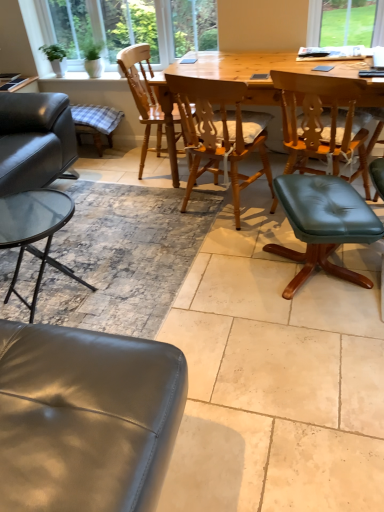
The height and width of the screenshot is (512, 384). What do you see at coordinates (225, 80) in the screenshot?
I see `natural wood table at center` at bounding box center [225, 80].

Describe the element at coordinates (323, 224) in the screenshot. The width and height of the screenshot is (384, 512). I see `teal leather stool at center-right, positioned as the 2th bar stool in top-to-bottom order` at that location.

How much space does plaid fabric cushion at left, which is the 1th bar stool in left-to-right order, occupy horizontally?

plaid fabric cushion at left, which is the 1th bar stool in left-to-right order, is 13.10 inches in width.

What do you see at coordinates (320, 123) in the screenshot? I see `green leather stool at center, the third chair positioned from the left` at bounding box center [320, 123].

I want to click on natural wood table at center, so click(x=225, y=80).

In the scene shown: Considering the relative sizes of wooden chair at center, which appears as the second chair when viewed from the left, and natural wood table at center in the image provided, is wooden chair at center, which appears as the second chair when viewed from the left, smaller than natural wood table at center?

Yes, wooden chair at center, which appears as the second chair when viewed from the left, is smaller than natural wood table at center.

In the scene shown: Can you tell me how much wooden chair at center, which appears as the second chair when viewed from the left, and natural wood table at center differ in facing direction?

wooden chair at center, which appears as the second chair when viewed from the left, and natural wood table at center are facing 164 degrees away from each other.

In the scene shown: Looking at their sizes, would you say wooden chair at center, the second chair in the right-to-left sequence, is wider or thinner than natural wood table at center?

wooden chair at center, the second chair in the right-to-left sequence, is thinner than natural wood table at center.

Where is `kitchen & dining room table above the wooden chair at center, the second chair in the right-to-left sequence (from the image's perspective)`? This screenshot has height=512, width=384. kitchen & dining room table above the wooden chair at center, the second chair in the right-to-left sequence (from the image's perspective) is located at coordinates (225, 80).

Does green leather stool at center, the 1th chair positioned from the right, lie in front of wooden chair at center, which appears as the second chair when viewed from the left?

Yes, green leather stool at center, the 1th chair positioned from the right, is closer to the camera.

Identify the location of chair below the wooden chair at center, which appears as the second chair when viewed from the left (from the image's perspective). This screenshot has height=512, width=384. (320, 123).

Can you confirm if green leather stool at center, the 1th chair positioned from the right, is smaller than wooden chair at center, which appears as the second chair when viewed from the left?

Incorrect, green leather stool at center, the 1th chair positioned from the right, is not smaller in size than wooden chair at center, which appears as the second chair when viewed from the left.

Is green leather stool at center, the 1th chair positioned from the right, turned away from wooden chair at center, the second chair in the right-to-left sequence?

green leather stool at center, the 1th chair positioned from the right, is not turned away from wooden chair at center, the second chair in the right-to-left sequence.

From the image's perspective, between wooden chair at center, which appears as the second chair when viewed from the left, and wooden chair at center, which ranks as the 1th chair in left-to-right order, which one is located above?

wooden chair at center, which ranks as the 1th chair in left-to-right order, appears higher in the image.

Which object is thinner, wooden chair at center, which appears as the second chair when viewed from the left, or wooden chair at center, which ranks as the 1th chair in left-to-right order?

wooden chair at center, which ranks as the 1th chair in left-to-right order, is thinner.

From a real-world perspective, is wooden chair at center, which appears as the second chair when viewed from the left, on top of wooden chair at center, which ranks as the 1th chair in left-to-right order?

Correct, in the physical world, wooden chair at center, which appears as the second chair when viewed from the left, is higher than wooden chair at center, which ranks as the 1th chair in left-to-right order.

Is wooden chair at center, which appears as the second chair when viewed from the left, oriented away from wooden chair at center, which ranks as the 1th chair in left-to-right order?

wooden chair at center, which appears as the second chair when viewed from the left, is not turned away from wooden chair at center, which ranks as the 1th chair in left-to-right order.

Is teal leather stool at center-right, the 1th bar stool from the bottom, taller or shorter than green leather stool at center, the third chair positioned from the left?

In the image, teal leather stool at center-right, the 1th bar stool from the bottom, appears to be shorter than green leather stool at center, the third chair positioned from the left.

Based on their positions, is teal leather stool at center-right, the 1th bar stool from the bottom, located to the left or right of green leather stool at center, the 1th chair positioned from the right?

In the image, teal leather stool at center-right, the 1th bar stool from the bottom, appears on the left side of green leather stool at center, the 1th chair positioned from the right.

From a real-world perspective, which object stands above the other?

In real-world perspective, green leather stool at center, the third chair positioned from the left, is above.

Is green leather stool at center, the 1th chair positioned from the right, surrounded by teal leather stool at center-right, positioned as the 2th bar stool in back-to-front order?

Definitely not — green leather stool at center, the 1th chair positioned from the right, is not inside teal leather stool at center-right, positioned as the 2th bar stool in back-to-front order.

Identify the location of window frame that is above the natural wood table at center (from a real-world perspective). (130, 27).

Is wooden frame at upper left wider than natural wood table at center?

In fact, wooden frame at upper left might be narrower than natural wood table at center.

Which object is positioned more to the right, wooden frame at upper left or natural wood table at center?

Positioned to the right is natural wood table at center.

Is wooden frame at upper left completely or partially outside of natural wood table at center?

Absolutely, wooden frame at upper left is external to natural wood table at center.

This screenshot has width=384, height=512. Identify the location of kitchen & dining room table located on the right of wooden chair at center, the second chair in the right-to-left sequence. (225, 80).

Consider the image. From the image's perspective, is natural wood table at center located above wooden chair at center, which appears as the second chair when viewed from the left?

Yes, from the image's perspective, natural wood table at center is over wooden chair at center, which appears as the second chair when viewed from the left.

Relative to wooden chair at center, the second chair in the right-to-left sequence, is natural wood table at center in front or behind?

Clearly, natural wood table at center is behind wooden chair at center, the second chair in the right-to-left sequence.

Is wooden chair at center, which appears as the second chair when viewed from the left, at the right side of green leather stool at center, the 1th chair positioned from the right?

Incorrect, wooden chair at center, which appears as the second chair when viewed from the left, is not on the right side of green leather stool at center, the 1th chair positioned from the right.

Does wooden chair at center, the second chair in the right-to-left sequence, have a lesser width compared to green leather stool at center, the third chair positioned from the left?

Yes, wooden chair at center, the second chair in the right-to-left sequence, is thinner than green leather stool at center, the third chair positioned from the left.

From the image's perspective, is wooden chair at center, which appears as the second chair when viewed from the left, located above or below green leather stool at center, the 1th chair positioned from the right?

Clearly, from the image's perspective, wooden chair at center, which appears as the second chair when viewed from the left, is above green leather stool at center, the 1th chair positioned from the right.

Between wooden chair at center, which appears as the second chair when viewed from the left, and green leather stool at center, the 1th chair positioned from the right, which one has less height?

With less height is green leather stool at center, the 1th chair positioned from the right.

Identify the location of kitchen & dining room table on the right of wooden chair at center, which appears as the second chair when viewed from the left. (225, 80).

Locate an element on the screen. the 2nd chair directly beneath the wooden chair at center, which appears as the second chair when viewed from the left (from a real-world perspective) is located at coordinates (320, 123).

Consider the image. From the image, which object appears to be nearer to plaid fabric cushion at left, the 1th bar stool positioned from the back, natural wood table at center or wooden chair at center, which appears as the second chair when viewed from the left?

natural wood table at center is closer to plaid fabric cushion at left, the 1th bar stool positioned from the back.

From the image, which object appears to be nearer to natural wood table at center, wooden chair at center, the second chair in the right-to-left sequence, or wooden chair at center, which is the 3th chair from right to left?

wooden chair at center, the second chair in the right-to-left sequence, is closer to natural wood table at center.

Which object lies nearer to the anchor point plaid fabric cushion at left, which is the 1th bar stool in left-to-right order, wooden frame at upper left or teal leather stool at center-right, positioned as the 2th bar stool in back-to-front order?

Among the two, wooden frame at upper left is located nearer to plaid fabric cushion at left, which is the 1th bar stool in left-to-right order.

Estimate the real-world distances between objects in this image. Which object is further from wooden chair at center, which is the 3th chair from right to left, plaid fabric cushion at left, the 1th bar stool positioned from the back, or wooden frame at upper left?

Among the two, wooden frame at upper left is located further to wooden chair at center, which is the 3th chair from right to left.

Estimate the real-world distances between objects in this image. Which object is closer to wooden frame at upper left, green leather stool at center, the third chair positioned from the left, or natural wood table at center?

natural wood table at center is positioned closer to the anchor wooden frame at upper left.

Estimate the real-world distances between objects in this image. Which object is closer to wooden chair at center, the second chair in the right-to-left sequence, wooden chair at center, which is the 3th chair from right to left, or green leather stool at center, the third chair positioned from the left?

green leather stool at center, the third chair positioned from the left, is closer to wooden chair at center, the second chair in the right-to-left sequence.

Looking at the image, which one is located closer to teal leather stool at center-right, which is the first bar stool in right-to-left order, wooden chair at center, which ranks as the 1th chair in left-to-right order, or plaid fabric cushion at left, positioned as the second bar stool in front-to-back order?

wooden chair at center, which ranks as the 1th chair in left-to-right order, lies closer to teal leather stool at center-right, which is the first bar stool in right-to-left order, than the other object.

Which object lies further to the anchor point teal leather stool at center-right, placed as the first bar stool when sorted from front to back, wooden chair at center, which appears as the second chair when viewed from the left, or wooden frame at upper left?

wooden frame at upper left.

The image size is (384, 512). What are the coordinates of `chair that lies between wooden chair at center, the second chair in the right-to-left sequence, and teal leather stool at center-right, which ranks as the 2th bar stool in left-to-right order, from top to bottom` in the screenshot? It's located at (320, 123).

Where is `kitchen & dining room table located between plaid fabric cushion at left, the 1th bar stool positioned from the back, and teal leather stool at center-right, placed as the first bar stool when sorted from front to back, in the left-right direction`? kitchen & dining room table located between plaid fabric cushion at left, the 1th bar stool positioned from the back, and teal leather stool at center-right, placed as the first bar stool when sorted from front to back, in the left-right direction is located at coordinates (225, 80).

Where is `window frame positioned between wooden chair at center, the second chair in the right-to-left sequence, and plaid fabric cushion at left, which ranks as the second bar stool in bottom-to-top order, from near to far`? window frame positioned between wooden chair at center, the second chair in the right-to-left sequence, and plaid fabric cushion at left, which ranks as the second bar stool in bottom-to-top order, from near to far is located at coordinates (130, 27).

At what (x,y) coordinates should I click in order to perform the action: click on chair between wooden chair at center, the second chair in the right-to-left sequence, and plaid fabric cushion at left, which is the 1th bar stool in left-to-right order, along the z-axis. Please return your answer as a coordinate pair (x, y). Looking at the image, I should click on (142, 94).